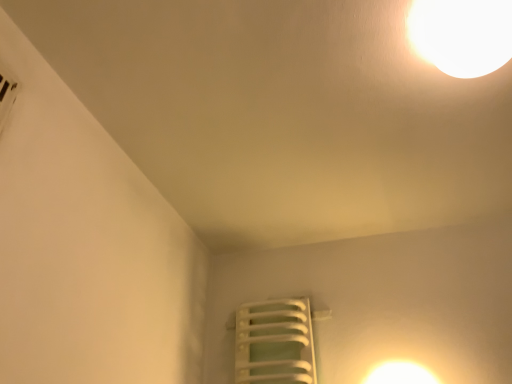
Question: Considering the positions of white glossy lampshade at upper right and white glossy light at upper right in the image, is white glossy lampshade at upper right wider or thinner than white glossy light at upper right?

Choices:
 (A) thin
 (B) wide

Answer: (B)

Question: Considering the positions of white glossy lampshade at upper right and white glossy light at upper right in the image, is white glossy lampshade at upper right bigger or smaller than white glossy light at upper right?

Choices:
 (A) big
 (B) small

Answer: (A)

Question: Which object is positioned closest to the white glossy lampshade at upper right?

Choices:
 (A) white glossy light at upper right
 (B) white plastic radiator at lower center

Answer: (A)

Question: Based on their relative distances, which object is farther from the white glossy light at upper right?

Choices:
 (A) white plastic radiator at lower center
 (B) white glossy lampshade at upper right

Answer: (B)